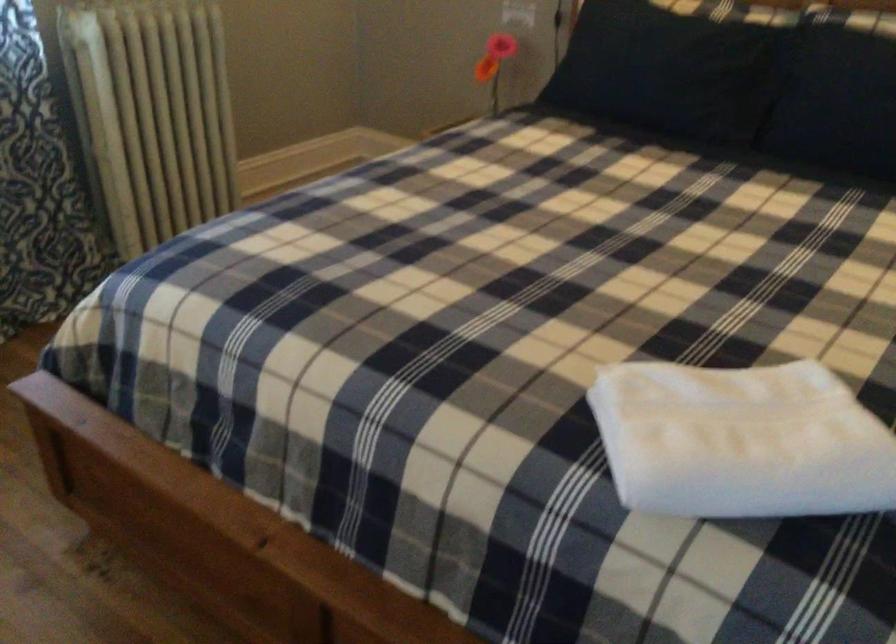
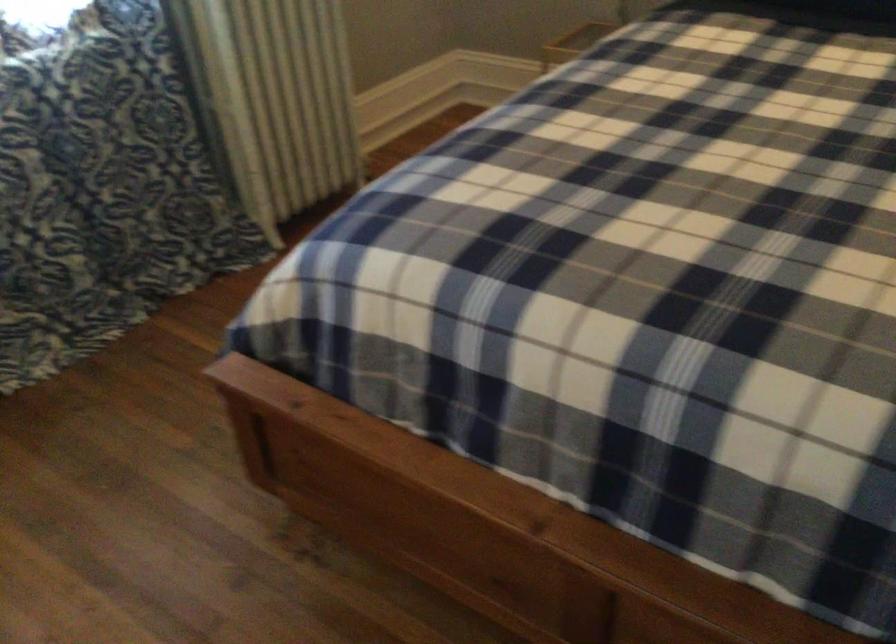
Where in the second image is the point corresponding to pixel 383 335 from the first image?

(633, 279)